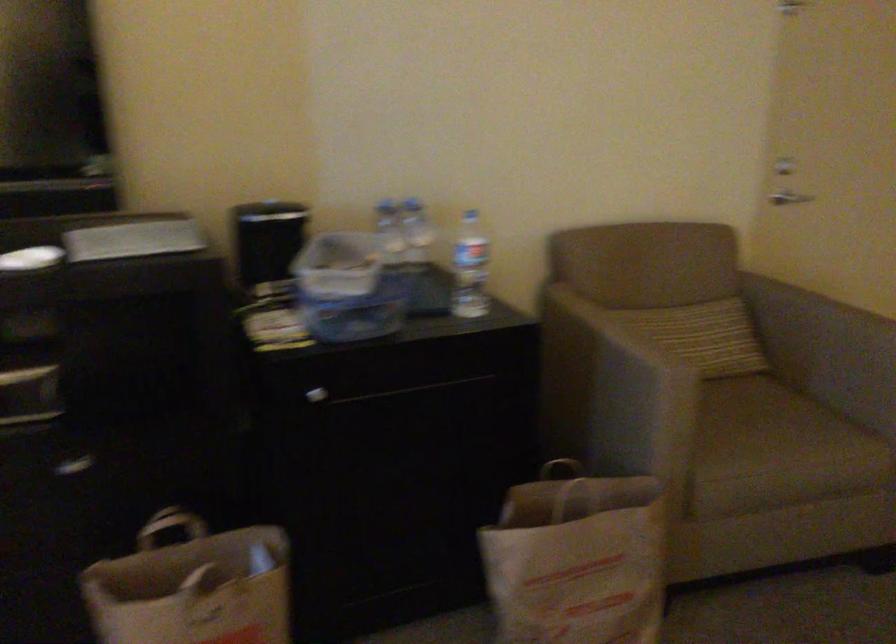
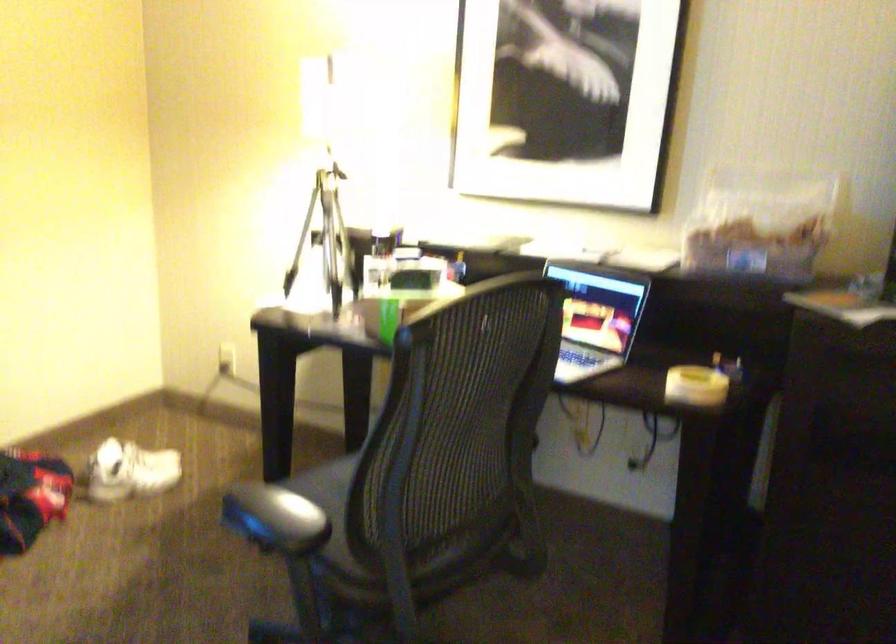
Question: How did the camera likely rotate?

Choices:
 (A) Left
 (B) Right
 (C) Up
 (D) Down

Answer: (A)